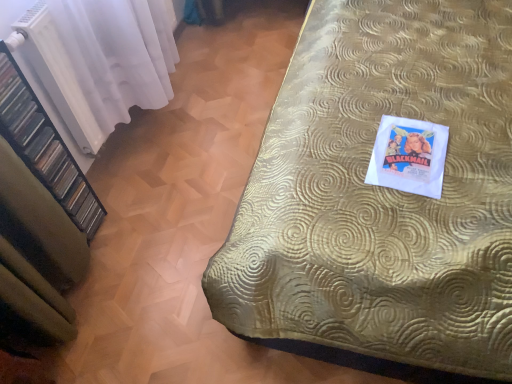
Question: From their relative heights in the image, would you say gold textured bedspread at upper right is taller or shorter than black plastic shelf at left?

Choices:
 (A) short
 (B) tall

Answer: (A)

Question: Is point (406, 230) closer or farther from the camera than point (57, 145)?

Choices:
 (A) farther
 (B) closer

Answer: (B)

Question: Based on their relative distances, which object is nearer to the black plastic shelf at left?

Choices:
 (A) white sheer curtain at left
 (B) gold textured bedspread at upper right

Answer: (A)

Question: Which object is the farthest from the white sheer curtain at left?

Choices:
 (A) gold textured bedspread at upper right
 (B) black plastic shelf at left

Answer: (A)